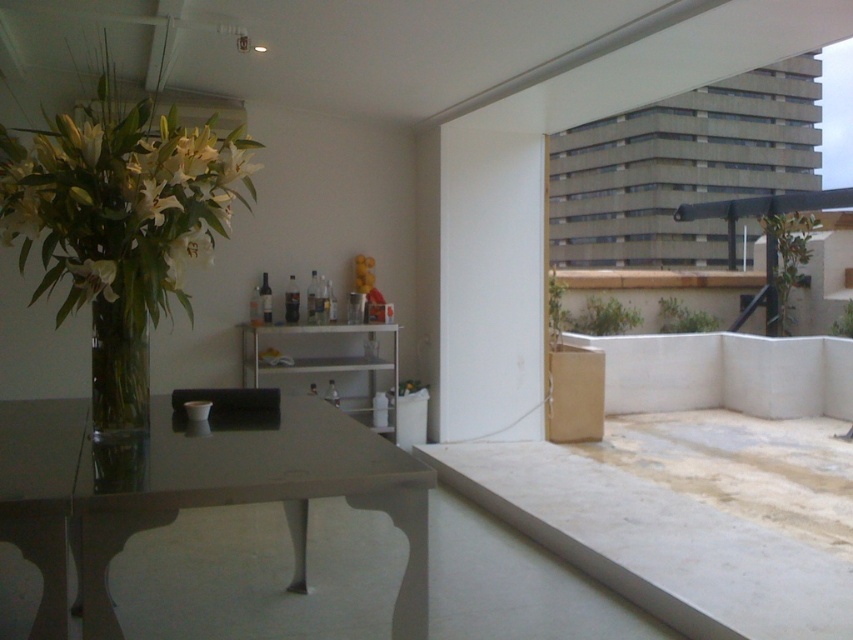
Question: In this image, where is clear glass vase at left located relative to translucent glass vase at left?

Choices:
 (A) below
 (B) above

Answer: (A)

Question: Which point appears farthest from the camera in this image?

Choices:
 (A) (140, 406)
 (B) (167, 500)

Answer: (A)

Question: Is glossy glass table at center to the left of translucent glass vase at left from the viewer's perspective?

Choices:
 (A) yes
 (B) no

Answer: (B)

Question: Which of these objects is positioned farthest from the translucent glass vase at left?

Choices:
 (A) clear glass vase at left
 (B) glossy glass table at center

Answer: (B)

Question: Is clear glass vase at left positioned before translucent glass vase at left?

Choices:
 (A) no
 (B) yes

Answer: (A)

Question: Which of the following is the closest to the observer?

Choices:
 (A) clear glass vase at left
 (B) translucent glass vase at left
 (C) glossy glass table at center

Answer: (C)